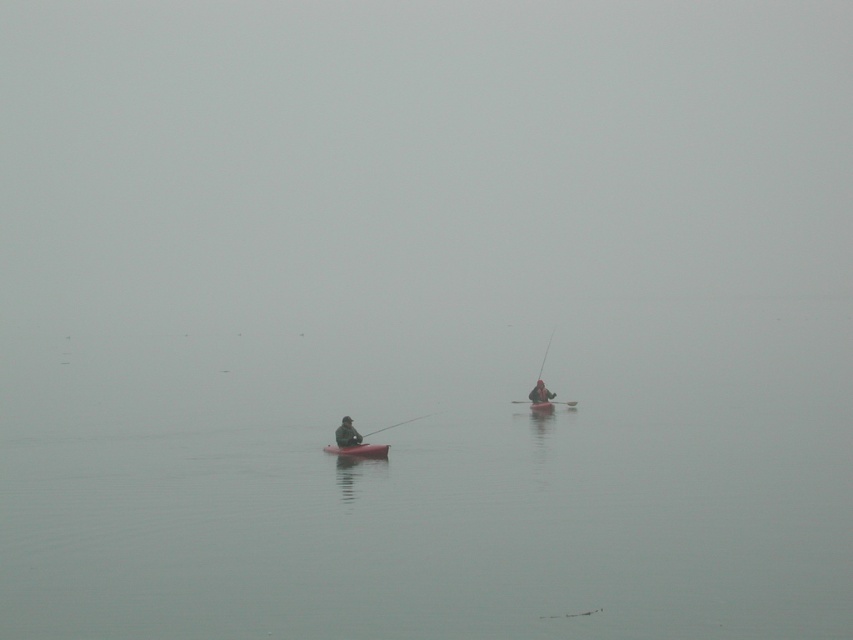
You are navigating a small boat and need to reach the matte pink canoe at center. Based on the coordinates provided in the scene description, what direction should you head from your current position at point 0.5, 0.5?

The matte pink canoe at center is located at point (358,451). From your current position at (426,320), you should head northeast to reach it.

Based on the photo, you are standing on a dock and see the smooth plastic paddle at center in the water. If you want to reach it without getting wet, can you just grab it with your hand from where you are?

The smooth plastic paddle at center is 33.95 meters from camera, so you cannot reach it with your hand from the dock without getting wet.